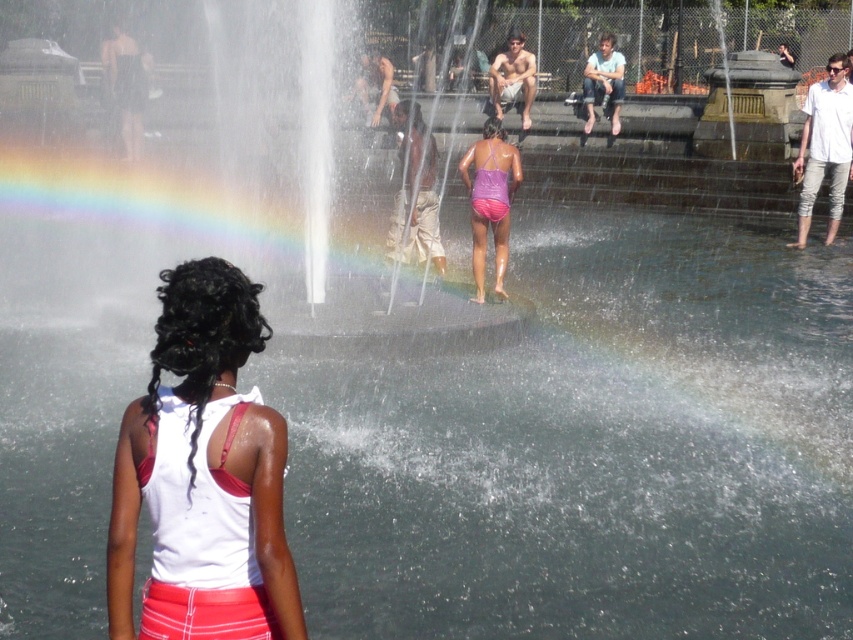
Does point (265, 481) come farther from viewer compared to point (490, 192)?

That is False.

Based on the photo, between white matte tank top at center and purple matte swimsuit at center, which one has more height?

purple matte swimsuit at center

This screenshot has height=640, width=853. I want to click on white matte tank top at center, so click(x=202, y=465).

In order to click on white matte tank top at center in this screenshot , I will do `click(202, 465)`.